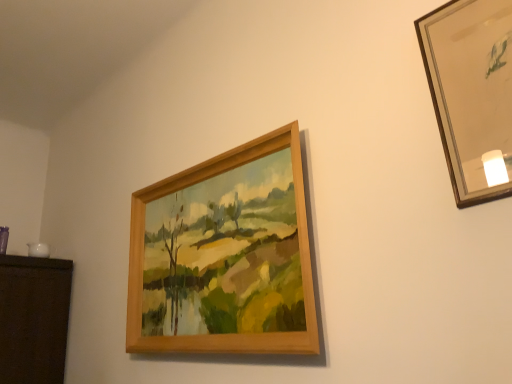
Question: From a real-world perspective, relative to wooden picture frame at upper right, positioned as the 1th picture frame in front-to-back order, is wooden frame at upper center, the first picture frame positioned from the left, vertically above or below?

Choices:
 (A) above
 (B) below

Answer: (B)

Question: From the image's perspective, is wooden frame at upper center, the first picture frame positioned from the left, located above or below wooden picture frame at upper right, positioned as the 1th picture frame in front-to-back order?

Choices:
 (A) above
 (B) below

Answer: (B)

Question: In terms of size, does wooden frame at upper center, which is counted as the second picture frame, starting from the front, appear bigger or smaller than wooden picture frame at upper right, positioned as the 1th picture frame in front-to-back order?

Choices:
 (A) big
 (B) small

Answer: (A)

Question: From a real-world perspective, is wooden picture frame at upper right, positioned as the 1th picture frame in front-to-back order, above or below wooden frame at upper center, the second picture frame from the right?

Choices:
 (A) below
 (B) above

Answer: (B)

Question: Would you say wooden picture frame at upper right, marked as the 2th picture frame in a back-to-front arrangement, is to the left or to the right of wooden frame at upper center, the second picture frame from the right, in the picture?

Choices:
 (A) left
 (B) right

Answer: (B)

Question: Considering the positions of wooden picture frame at upper right, which ranks as the 2th picture frame in left-to-right order, and wooden frame at upper center, the second picture frame from the right, in the image, is wooden picture frame at upper right, which ranks as the 2th picture frame in left-to-right order, taller or shorter than wooden frame at upper center, the second picture frame from the right,?

Choices:
 (A) short
 (B) tall

Answer: (A)

Question: In terms of width, does wooden picture frame at upper right, positioned as the 1th picture frame in front-to-back order, look wider or thinner when compared to wooden frame at upper center, which is counted as the second picture frame, starting from the front?

Choices:
 (A) thin
 (B) wide

Answer: (A)